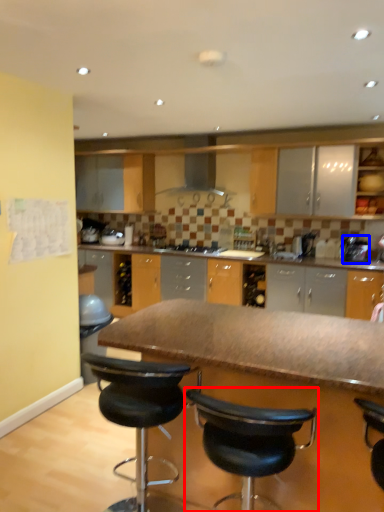
Question: Among these objects, which one is farthest to the camera, chair (highlighted by a red box) or appliance (highlighted by a blue box)?

Choices:
 (A) chair
 (B) appliance

Answer: (B)